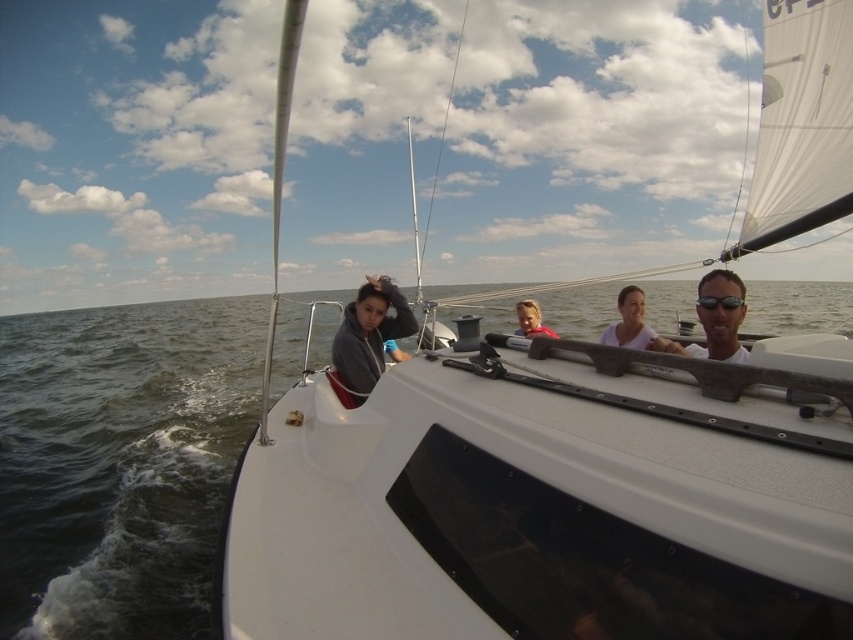
Question: Can you confirm if dark gray water at center is bigger than gray fleece jacket at center?

Choices:
 (A) yes
 (B) no

Answer: (A)

Question: Is dark gray water at center thinner than gray fleece jacket at center?

Choices:
 (A) no
 (B) yes

Answer: (A)

Question: Estimate the real-world distances between objects in this image. Which object is closer to the white matte sunglasses at upper right?

Choices:
 (A) gray fleece jacket at center
 (B) black rubber goggles at upper right

Answer: (B)

Question: Which point is closer to the camera taking this photo?

Choices:
 (A) (717, 355)
 (B) (737, 305)
 (C) (534, 317)

Answer: (B)

Question: Does dark gray water at center have a smaller size compared to gray fleece jacket at center?

Choices:
 (A) no
 (B) yes

Answer: (A)

Question: Estimate the real-world distances between objects in this image. Which object is farther from the white matte sunglasses at upper right?

Choices:
 (A) black rubber goggles at upper right
 (B) dark gray water at center

Answer: (B)